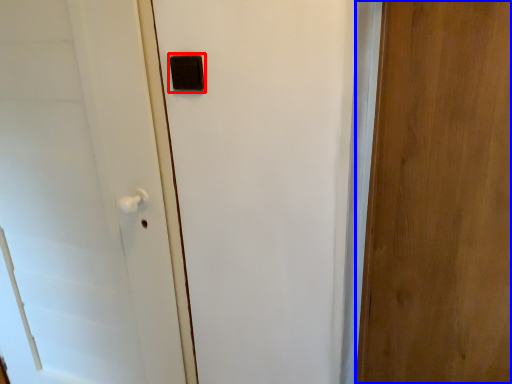
Question: Which object is further to the camera taking this photo, light switch (highlighted by a red box) or door (highlighted by a blue box)?

Choices:
 (A) light switch
 (B) door

Answer: (A)